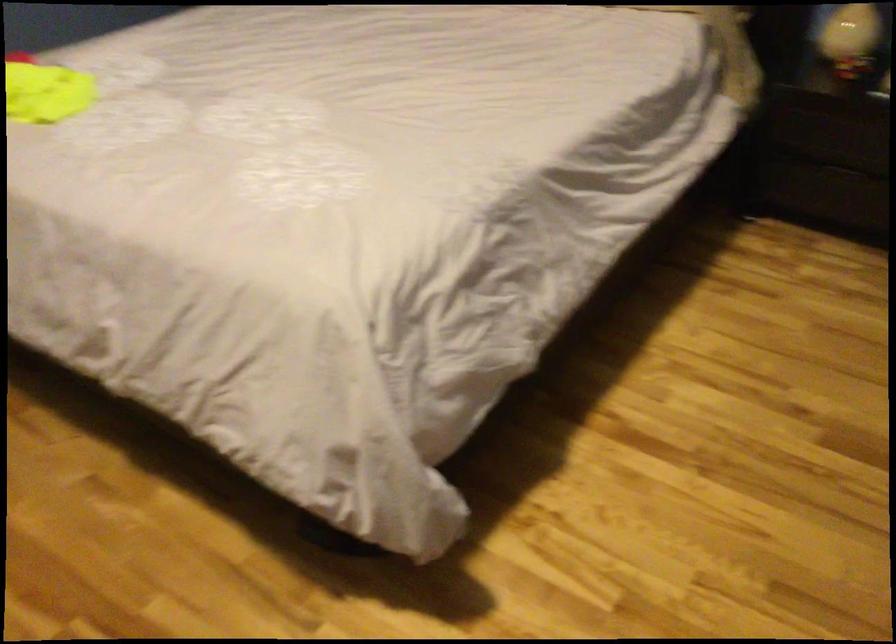
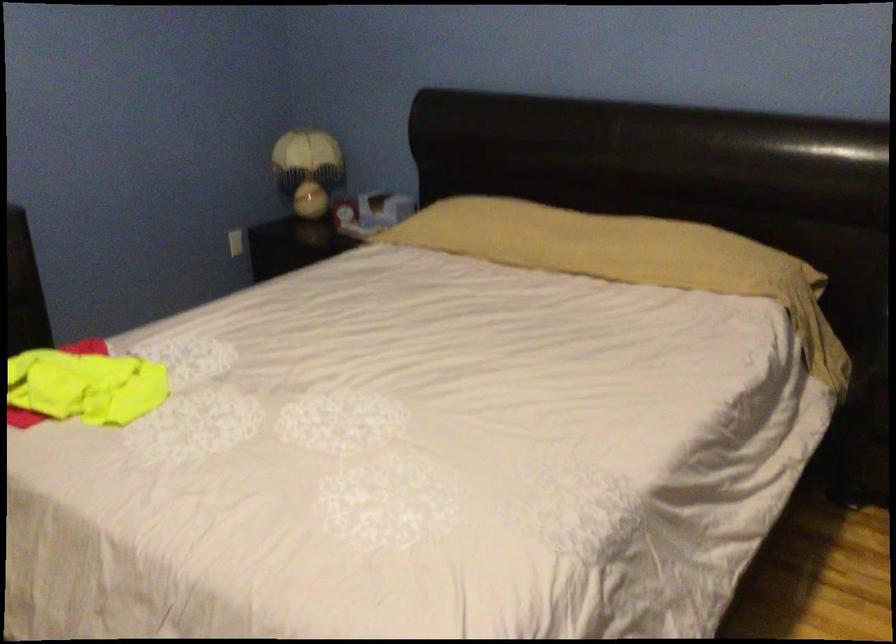
In a continuous first-person perspective shot, in which direction is the camera moving?

The movement direction of the cameraman is left, forward.